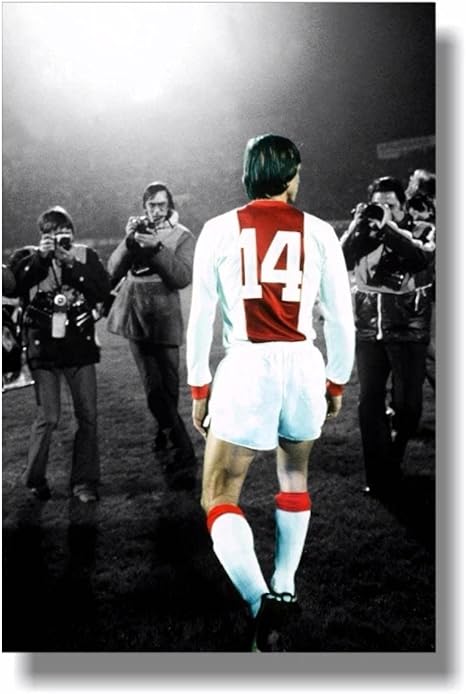
This screenshot has width=466, height=694. In order to click on sock in this screenshot , I will do `click(232, 559)`, `click(295, 516)`.